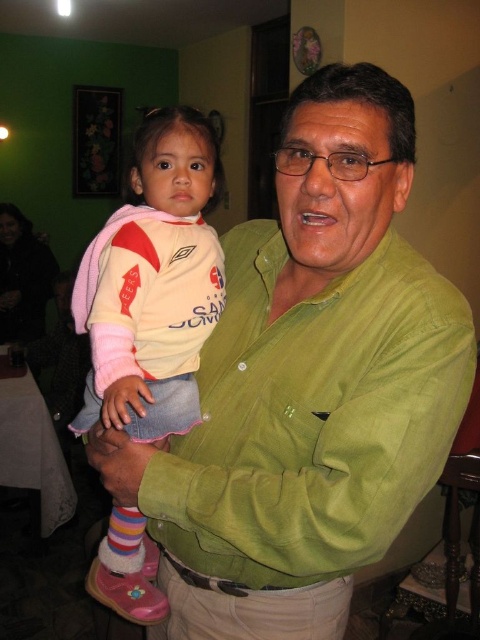
You are a photographer standing in front of the scene. You want to take a photo of both the green suede shirt at center and the green corduroy shirt at center. Which shirt will appear closer to you in the photo?

The green suede shirt at center will appear closer to you because it is positioned closer to the viewer than the green corduroy shirt at center.

In the scene, there are two shirts at the center of the image. The green corduroy shirt at center and the pink fabric shirt at center. Which one is smaller?

The green corduroy shirt at center is smaller than the pink fabric shirt at center.